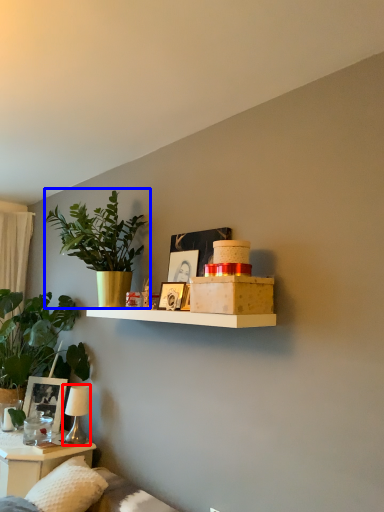
Question: Which object appears farthest to the camera in this image, table lamp (highlighted by a red box) or houseplant (highlighted by a blue box)?

Choices:
 (A) table lamp
 (B) houseplant

Answer: (A)